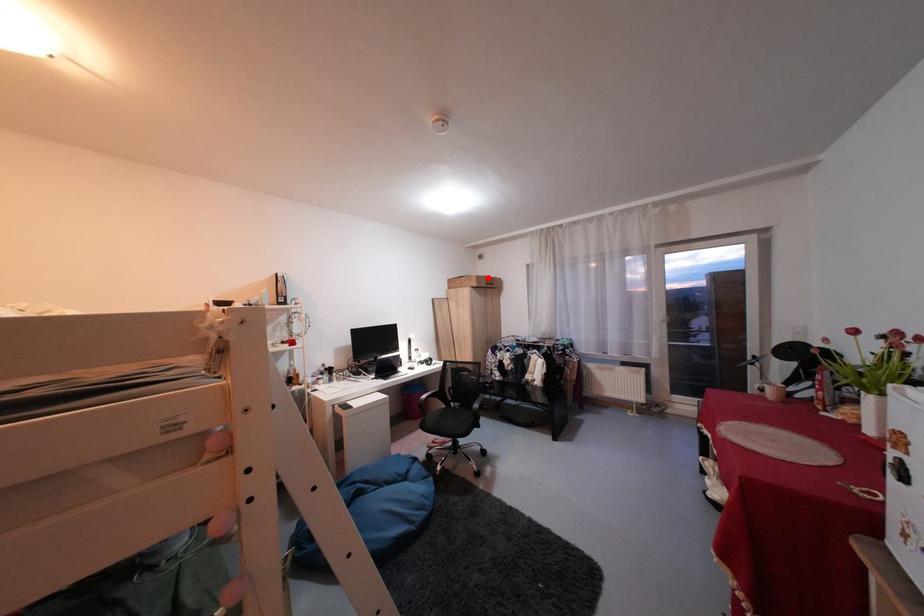
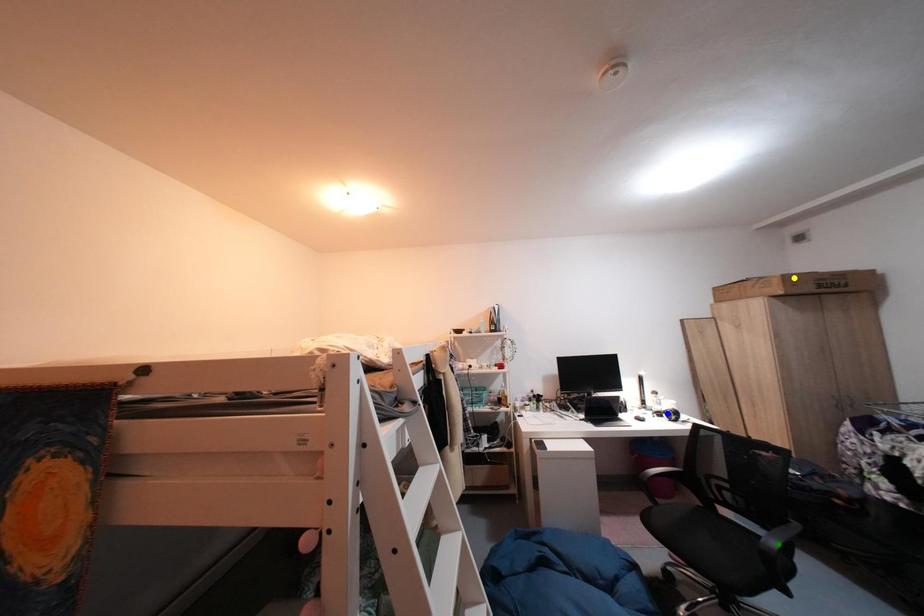
Question: I am providing you with two images of the same scene from different viewpoints. A red point is marked on the first image. You are given multiple points on the second image. Which mark in image 2 goes with the point in image 1?

Choices:
 (A) blue point
 (B) yellow point
 (C) green point

Answer: (B)